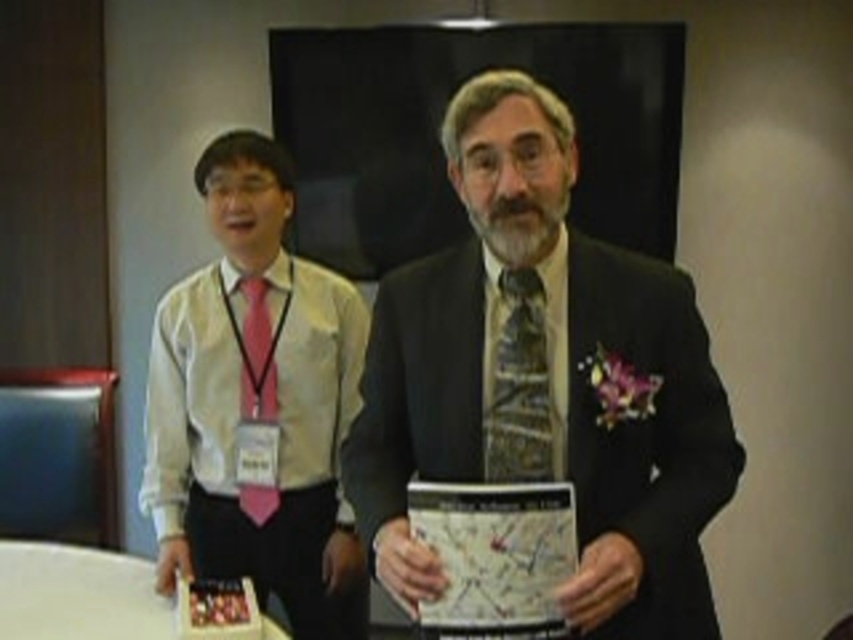
Question: Does matte black suit at center appear on the right side of white shirt at left?

Choices:
 (A) no
 (B) yes

Answer: (B)

Question: Which object is farther from the camera taking this photo?

Choices:
 (A) patterned silk tie at center
 (B) white shirt at left
 (C) white glossy round table at lower left

Answer: (B)

Question: Considering the real-world distances, which object is closest to the matte black suit at center?

Choices:
 (A) white shirt at left
 (B) pink satin tie at left
 (C) patterned silk tie at center

Answer: (C)

Question: Does white glossy round table at lower left appear under patterned silk tie at center?

Choices:
 (A) yes
 (B) no

Answer: (A)

Question: Which point is closer to the camera?

Choices:
 (A) (57, 547)
 (B) (244, 342)
 (C) (517, 417)
 (D) (508, 401)

Answer: (C)

Question: Is white glossy round table at lower left above patterned silk tie at center?

Choices:
 (A) yes
 (B) no

Answer: (B)